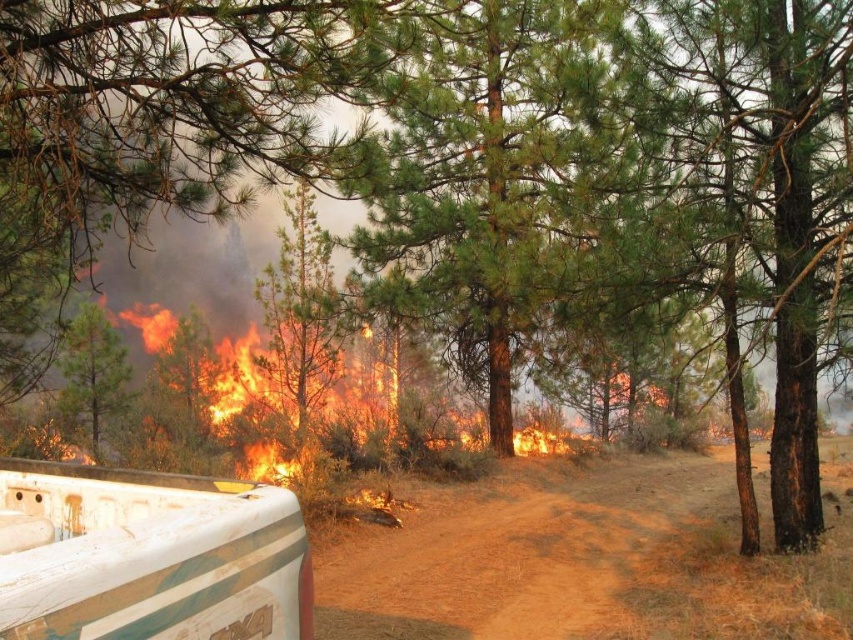
Between green pine tree at center and green rough bark tree at upper left, which one has less height?

With less height is green rough bark tree at upper left.

Which is above, green pine tree at center or green rough bark tree at upper left?

green pine tree at center

Looking at this image, who is more distant from viewer, (579, 230) or (83, 358)?

The point (83, 358) is behind.

In order to click on green pine tree at center in this screenshot , I will do `click(483, 173)`.

Who is lower down, rusty metal truck bed at lower left or green rough bark tree at upper left?

rusty metal truck bed at lower left is below.

The image size is (853, 640). In order to click on rusty metal truck bed at lower left in this screenshot , I will do `click(148, 556)`.

Is brown dirt track at center to the right of green pine tree at center from the viewer's perspective?

Indeed, brown dirt track at center is positioned on the right side of green pine tree at center.

Is brown dirt track at center bigger than green pine tree at center?

No, brown dirt track at center is not bigger than green pine tree at center.

Does point (503, 516) come farther from viewer compared to point (422, 150)?

No, (503, 516) is closer to viewer.

Image resolution: width=853 pixels, height=640 pixels. I want to click on brown dirt track at center, so click(x=584, y=563).